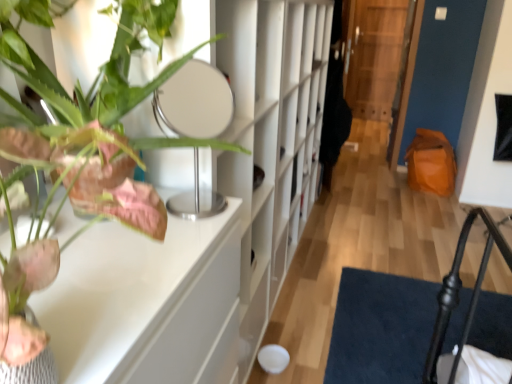
Question: Does white glossy table at upper left turn towards green matte plant at upper left?

Choices:
 (A) no
 (B) yes

Answer: (A)

Question: Is white glossy table at upper left not within green matte plant at upper left?

Choices:
 (A) yes
 (B) no

Answer: (A)

Question: Is white glossy table at upper left positioned with its back to green matte plant at upper left?

Choices:
 (A) no
 (B) yes

Answer: (A)

Question: Is green matte plant at upper left inside white glossy table at upper left?

Choices:
 (A) no
 (B) yes

Answer: (A)

Question: Considering the relative sizes of white glossy table at upper left and green matte plant at upper left in the image provided, is white glossy table at upper left thinner than green matte plant at upper left?

Choices:
 (A) no
 (B) yes

Answer: (B)

Question: Considering the positions of green matte plant at upper left and white matte bookshelf at center in the image, is green matte plant at upper left taller or shorter than white matte bookshelf at center?

Choices:
 (A) tall
 (B) short

Answer: (B)

Question: Is point (22, 334) positioned closer to the camera than point (307, 74)?

Choices:
 (A) farther
 (B) closer

Answer: (B)

Question: Is green matte plant at upper left inside or outside of white matte bookshelf at center?

Choices:
 (A) inside
 (B) outside

Answer: (B)

Question: From the image's perspective, is green matte plant at upper left located above or below white matte bookshelf at center?

Choices:
 (A) below
 (B) above

Answer: (A)

Question: Relative to white glossy table at upper left, is white matte bookshelf at center in front or behind?

Choices:
 (A) behind
 (B) front

Answer: (A)

Question: Is point (215, 170) closer or farther from the camera than point (212, 370)?

Choices:
 (A) closer
 (B) farther

Answer: (B)

Question: Considering the positions of white matte bookshelf at center and white glossy table at upper left in the image, is white matte bookshelf at center bigger or smaller than white glossy table at upper left?

Choices:
 (A) big
 (B) small

Answer: (A)

Question: Is white matte bookshelf at center to the left or to the right of white glossy table at upper left in the image?

Choices:
 (A) left
 (B) right

Answer: (B)

Question: Based on their positions, is white glossy table at upper left located to the left or right of transparent wooden door at center?

Choices:
 (A) right
 (B) left

Answer: (B)

Question: From the image's perspective, is white glossy table at upper left positioned above or below transparent wooden door at center?

Choices:
 (A) above
 (B) below

Answer: (B)